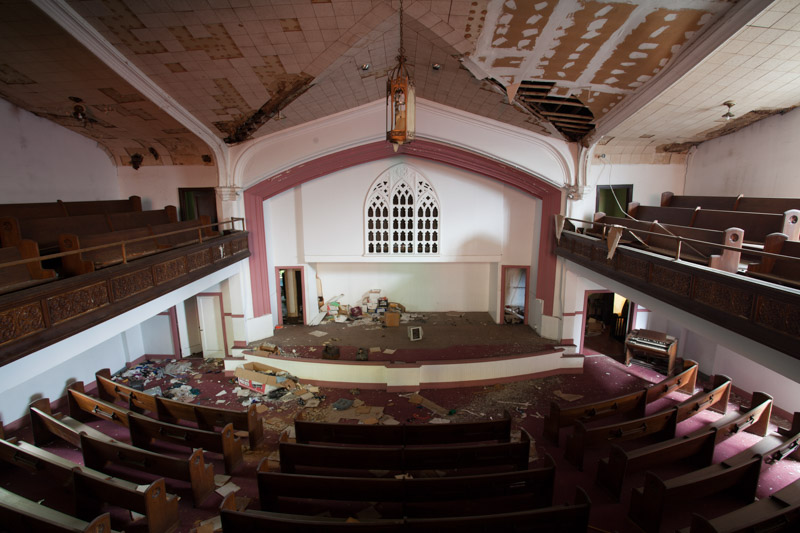
You are a GUI agent. You are given a task and a screenshot of the screen. Output one action in this format:
    pyautogui.click(x=<x>, y=<y>)
    Task: Click on the curtain
    Image resolution: width=800 pixels, height=533 pixels.
    Given the screenshot: What is the action you would take?
    pyautogui.click(x=514, y=281)